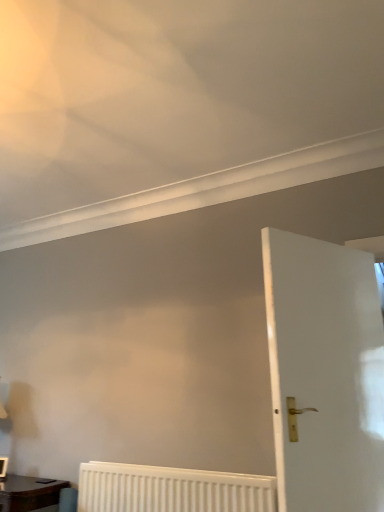
Question: Is matte brown wooden table at lower left looking in the opposite direction of white textured radiator at lower center?

Choices:
 (A) no
 (B) yes

Answer: (A)

Question: Are matte brown wooden table at lower left and white textured radiator at lower center beside each other?

Choices:
 (A) yes
 (B) no

Answer: (B)

Question: Is matte brown wooden table at lower left bigger than white textured radiator at lower center?

Choices:
 (A) yes
 (B) no

Answer: (A)

Question: Would you say matte brown wooden table at lower left is a long distance from white textured radiator at lower center?

Choices:
 (A) yes
 (B) no

Answer: (B)

Question: Does matte brown wooden table at lower left have a smaller size compared to white textured radiator at lower center?

Choices:
 (A) yes
 (B) no

Answer: (B)

Question: From the image's perspective, is matte brown wooden table at lower left under white textured radiator at lower center?

Choices:
 (A) no
 (B) yes

Answer: (B)

Question: From a real-world perspective, is white glossy door at right below matte brown wooden table at lower left?

Choices:
 (A) yes
 (B) no

Answer: (B)

Question: Does white glossy door at right have a lesser width compared to matte brown wooden table at lower left?

Choices:
 (A) no
 (B) yes

Answer: (B)

Question: Is white glossy door at right at the right side of matte brown wooden table at lower left?

Choices:
 (A) no
 (B) yes

Answer: (B)

Question: Considering the relative positions of white glossy door at right and matte brown wooden table at lower left in the image provided, is white glossy door at right behind matte brown wooden table at lower left?

Choices:
 (A) no
 (B) yes

Answer: (A)

Question: Is white glossy door at right oriented towards matte brown wooden table at lower left?

Choices:
 (A) no
 (B) yes

Answer: (A)

Question: Does white glossy door at right have a larger size compared to matte brown wooden table at lower left?

Choices:
 (A) no
 (B) yes

Answer: (B)

Question: From a real-world perspective, is white textured radiator at lower center below white glossy door at right?

Choices:
 (A) yes
 (B) no

Answer: (A)